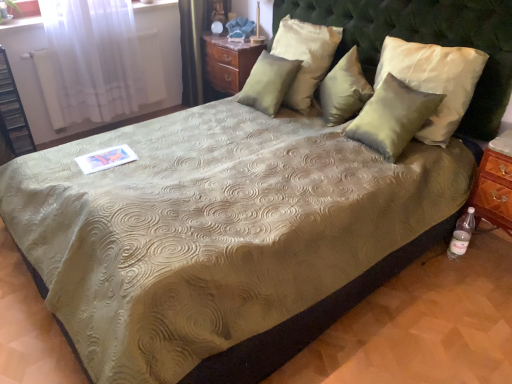
Where is `free location to the right of clear plastic bottle at lower right`? The height and width of the screenshot is (384, 512). free location to the right of clear plastic bottle at lower right is located at coordinates (484, 259).